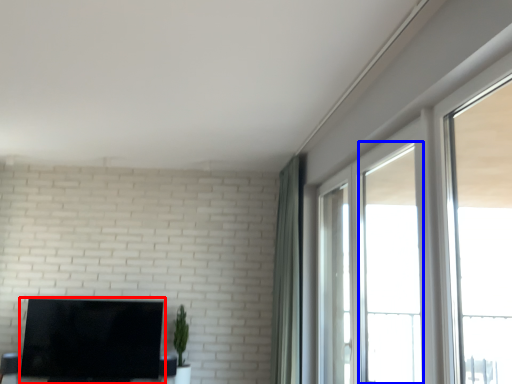
Question: Which object appears closest to the camera in this image, television (highlighted by a red box) or window (highlighted by a blue box)?

Choices:
 (A) television
 (B) window

Answer: (B)